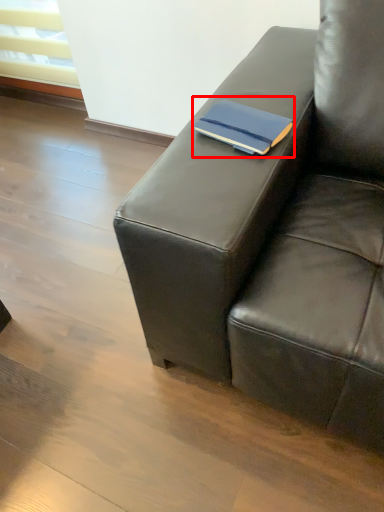
Question: From the image, what is the correct spatial relationship of paperback book (annotated by the red box) in relation to studio couch?

Choices:
 (A) left
 (B) right

Answer: (A)